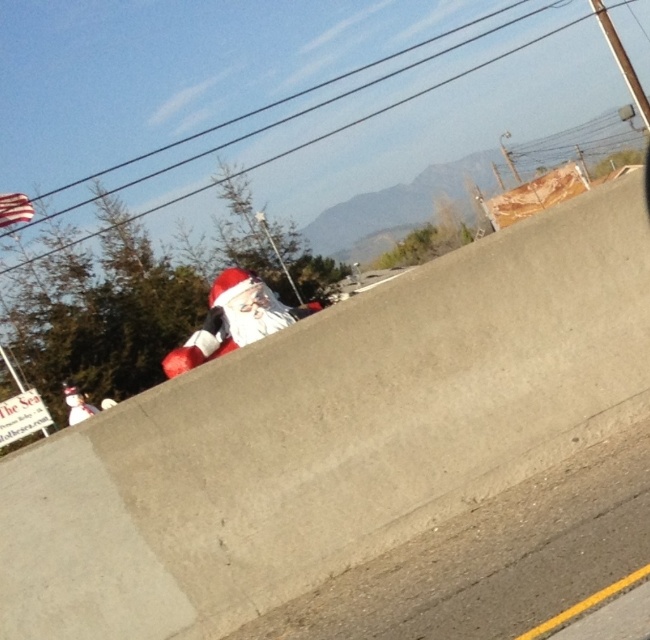
You are a delivery person who needs to place a 2 meter wide package between the fuzzy red santa at center and the white plush santa at lower left. Is there enough space?

The fuzzy red santa at center and the white plush santa at lower left are 6.75 meters apart from each other. Since the package is 2 meters wide, there is sufficient space to place it between them.

You are standing in the outdoor scene and want to approach the fuzzy red santa at center. Given that the concrete barrier is between you and the santa, can you estimate whether you can walk around it to reach him?

The distance between you and the fuzzy red santa at center is 4.69 meters, but the concrete barrier partially obscures him. Since the barrier is running diagonally, you can walk around it to reach him as long as there is a clear path on either side of the barrier.